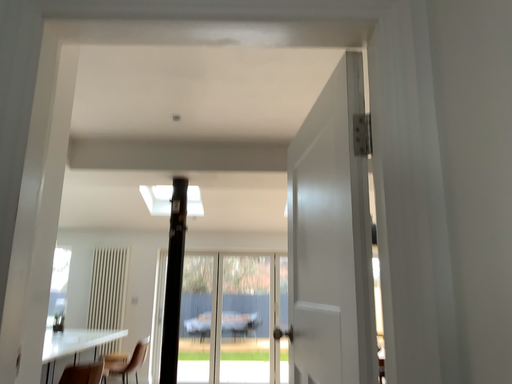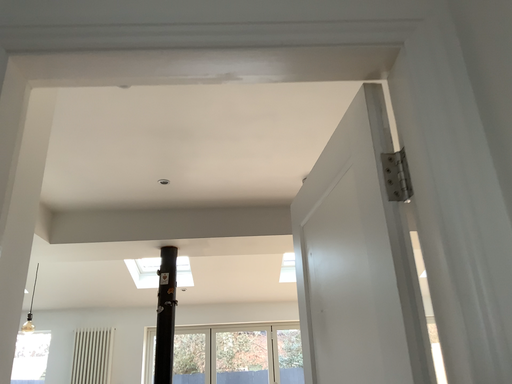
Question: Which way did the camera rotate in the video?

Choices:
 (A) rotated upward
 (B) rotated downward

Answer: (A)